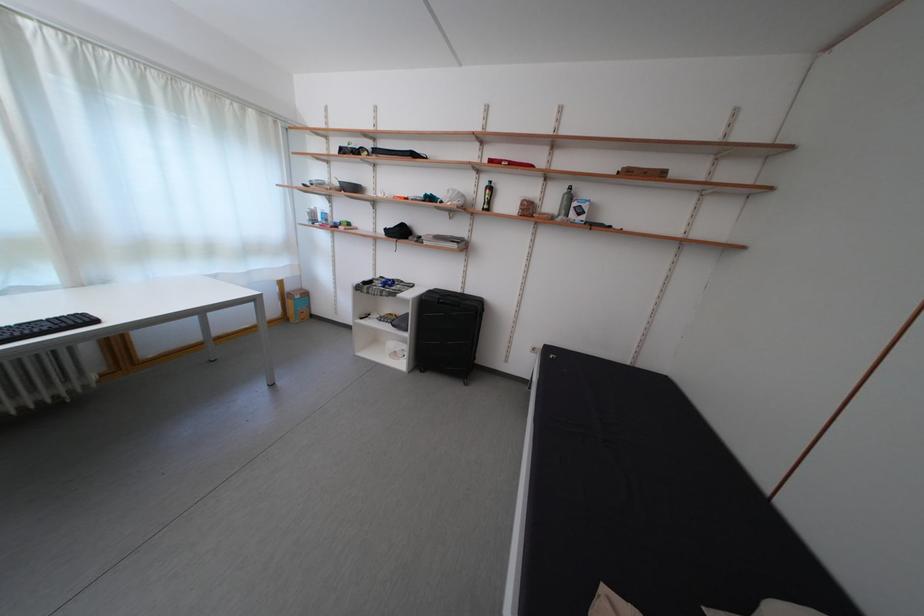
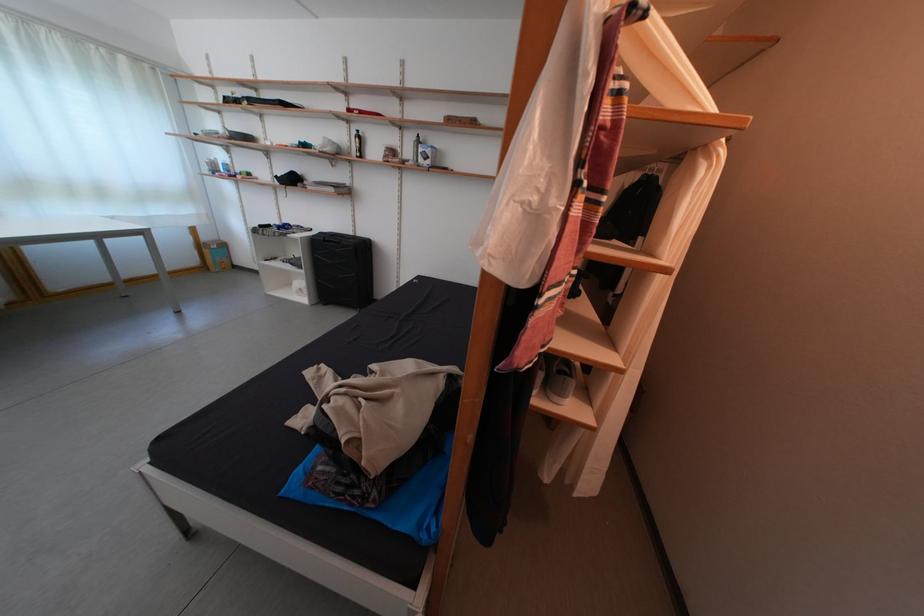
Which direction would the cameraman need to move to produce the second image?

The cameraman walked toward right, backward.